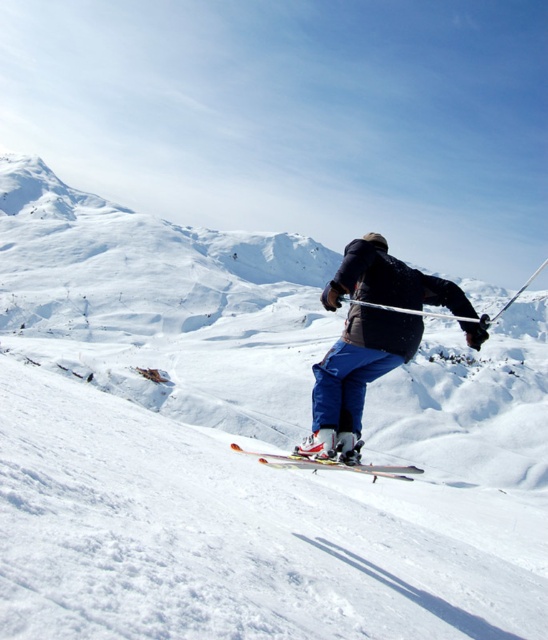
Is blue fabric pants at center positioned before shiny metallic skis at center?

Yes.

Locate an element on the screen. This screenshot has width=548, height=640. blue fabric pants at center is located at coordinates (356, 378).

This screenshot has height=640, width=548. I want to click on blue fabric pants at center, so click(356, 378).